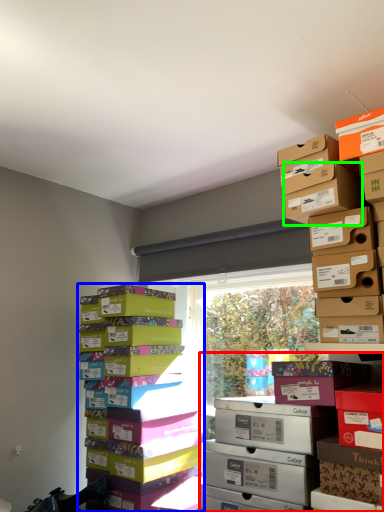
Question: Considering the real-world distances, which object is farthest from shelf (highlighted by a red box)? package (highlighted by a blue box) or cardboard box (highlighted by a green box)?

Choices:
 (A) package
 (B) cardboard box

Answer: (B)